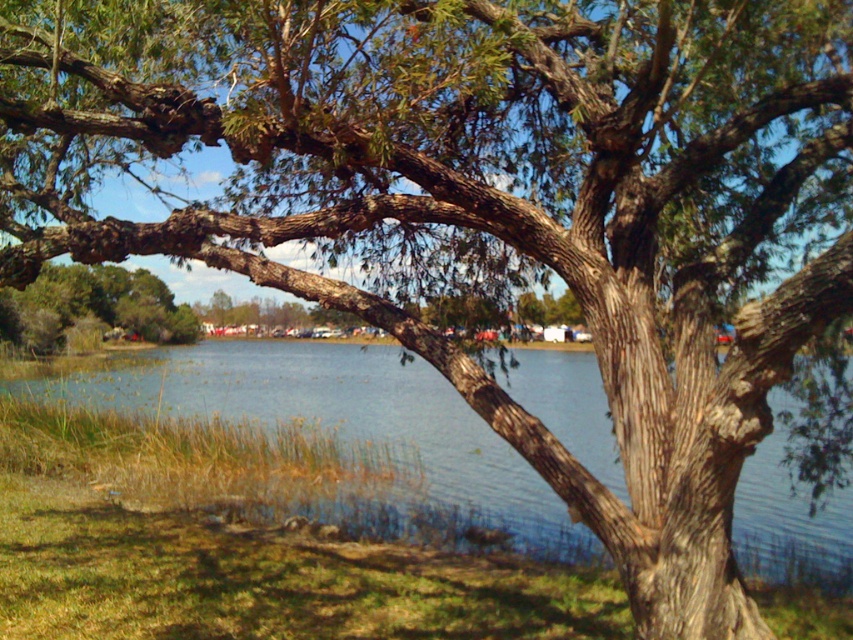
Question: Can you confirm if clear blue water at center is bigger than green leafy tree at lower left?

Choices:
 (A) no
 (B) yes

Answer: (B)

Question: Which point is farther from the camera taking this photo?

Choices:
 (A) (x=57, y=289)
 (B) (x=222, y=353)

Answer: (A)

Question: Among these objects, which one is farthest from the camera?

Choices:
 (A) clear blue water at center
 (B) green leafy tree at lower left

Answer: (B)

Question: Considering the relative positions of clear blue water at center and green leafy tree at lower left in the image provided, where is clear blue water at center located with respect to green leafy tree at lower left?

Choices:
 (A) left
 (B) right

Answer: (B)

Question: Is clear blue water at center thinner than green leafy tree at lower left?

Choices:
 (A) no
 (B) yes

Answer: (A)